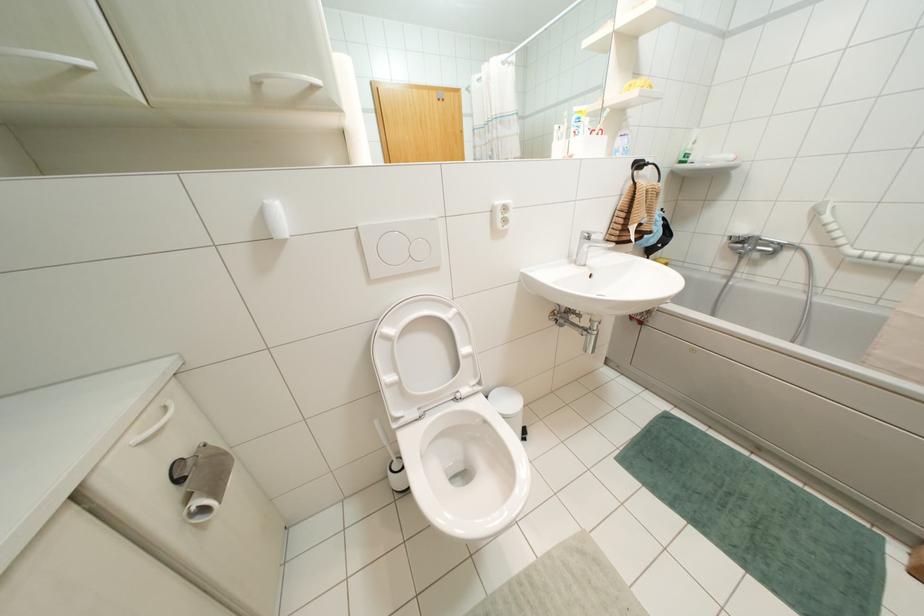
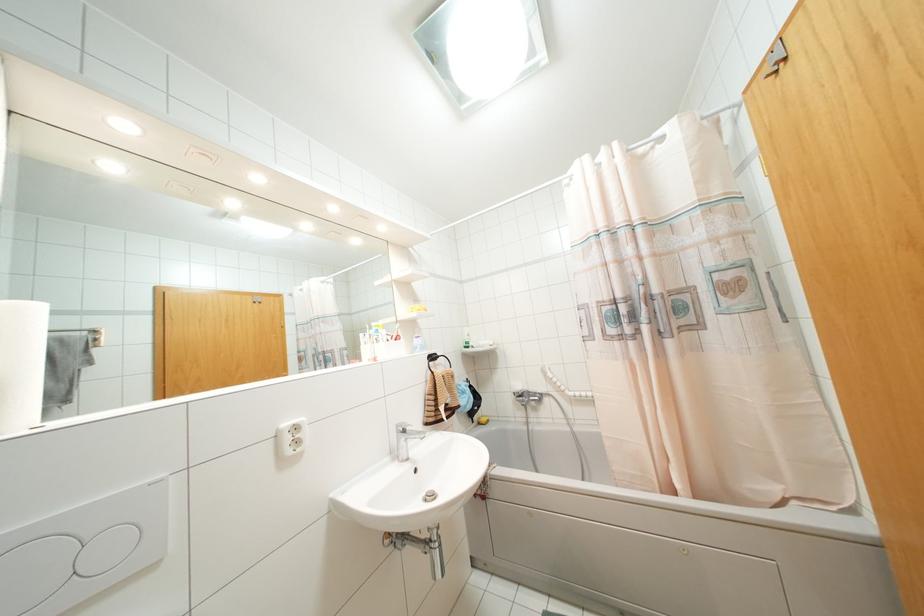
Locate, in the second image, the point that corresponds to point 505,207 in the first image.

(296, 428)